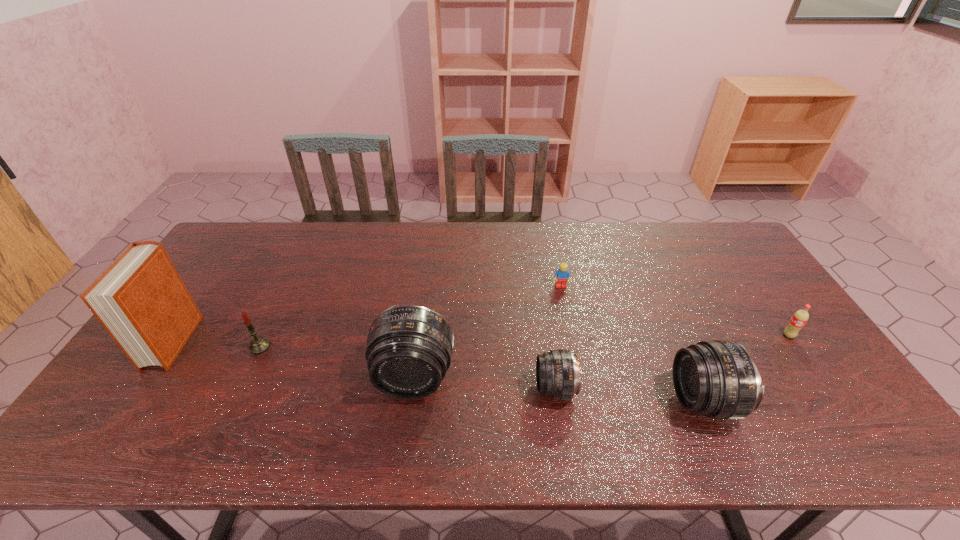
Find the location of a particular element. This screenshot has height=540, width=960. the leftmost telephoto lens is located at coordinates (409, 348).

This screenshot has height=540, width=960. In order to click on the second telephoto lens from right to left in this screenshot , I will do `click(557, 371)`.

Locate an element on the screen. the sixth object from left to right is located at coordinates (718, 379).

You are a GUI agent. You are given a task and a screenshot of the screen. Output one action in this format:
    pyautogui.click(x=<x>, y=<y>)
    Task: Click on the fifth shortest object
    This screenshot has height=540, width=960.
    Given the screenshot: What is the action you would take?
    pyautogui.click(x=718, y=379)

At what (x,y) coordinates should I click in order to perform the action: click on the farthest object. Please return your answer as a coordinate pair (x, y). Looking at the image, I should click on (562, 274).

Image resolution: width=960 pixels, height=540 pixels. In order to click on the shortest object in this screenshot , I will do `click(562, 274)`.

Find the location of a particular element. the sixth object from right to left is located at coordinates (258, 345).

Identify the location of soda. (800, 317).

Where is `the leftmost object`? the leftmost object is located at coordinates (140, 299).

Find the location of a particular element. the tallest object is located at coordinates (140, 299).